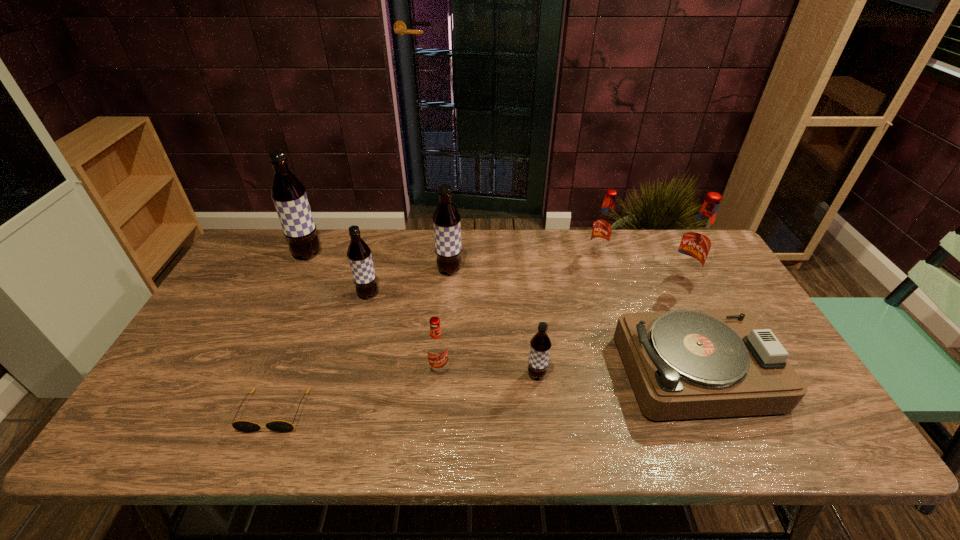
Select which brown root beer appears as the third closest to the biggest brown root beer. Please provide its 2D coordinates. Your answer should be formatted as a tuple, i.e. [(x, y)], where the tuple contains the x and y coordinates of a point satisfying the conditions above.

[(540, 344)]

In order to click on the closest brown root beer relative to the biggest brown root beer in this screenshot , I will do `click(359, 255)`.

Locate which red root beer is the third closest to the tallest object. Please provide its 2D coordinates. Your answer should be formatted as a tuple, i.e. [(x, y)], where the tuple contains the x and y coordinates of a point satisfying the conditions above.

[(696, 242)]

Identify which red root beer is the second closest to the second nearest brown root beer. Please provide its 2D coordinates. Your answer should be formatted as a tuple, i.e. [(x, y)], where the tuple contains the x and y coordinates of a point satisfying the conditions above.

[(603, 227)]